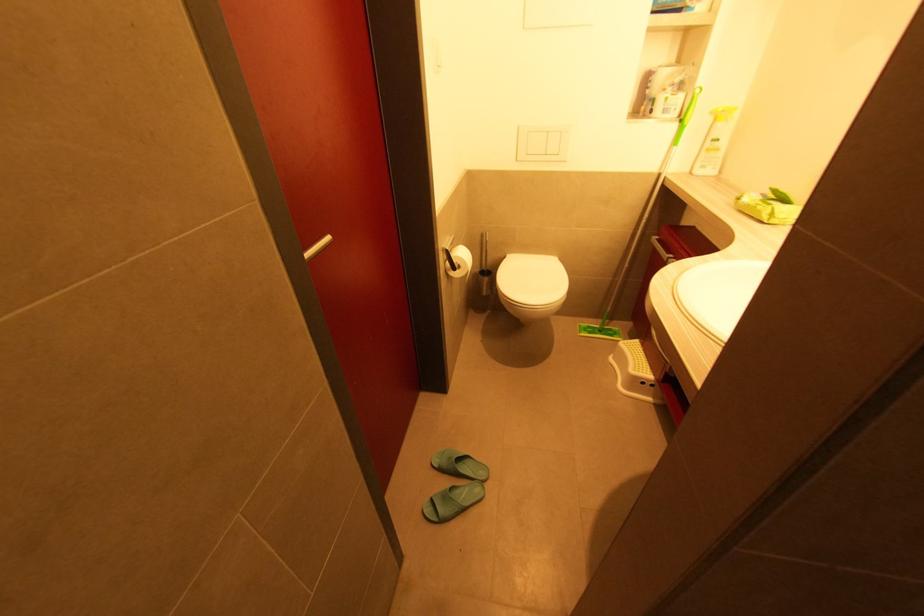
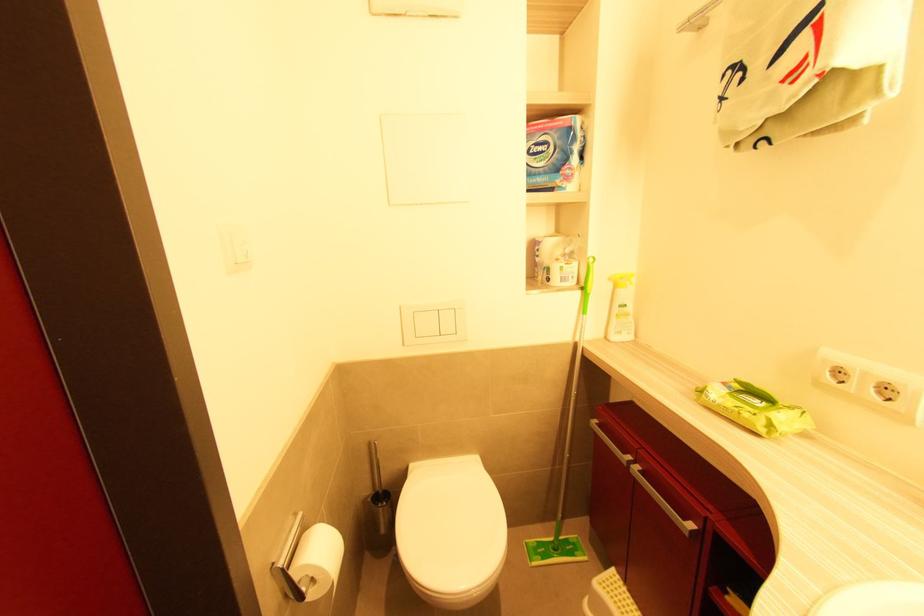
Question: In a continuous first-person perspective shot, in which direction is the camera moving?

Choices:
 (A) Left
 (B) Right
 (C) Forward
 (D) Backward

Answer: (C)